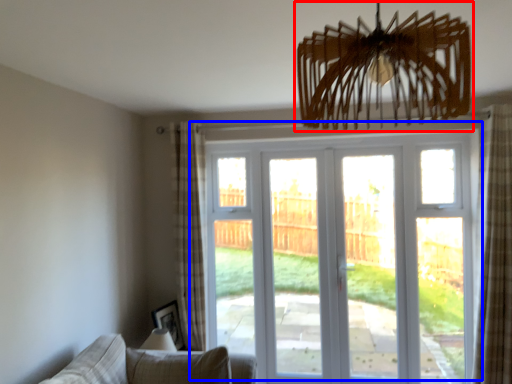
Question: Which object is closer to the camera taking this photo, chandelier (highlighted by a red box) or door (highlighted by a blue box)?

Choices:
 (A) chandelier
 (B) door

Answer: (A)